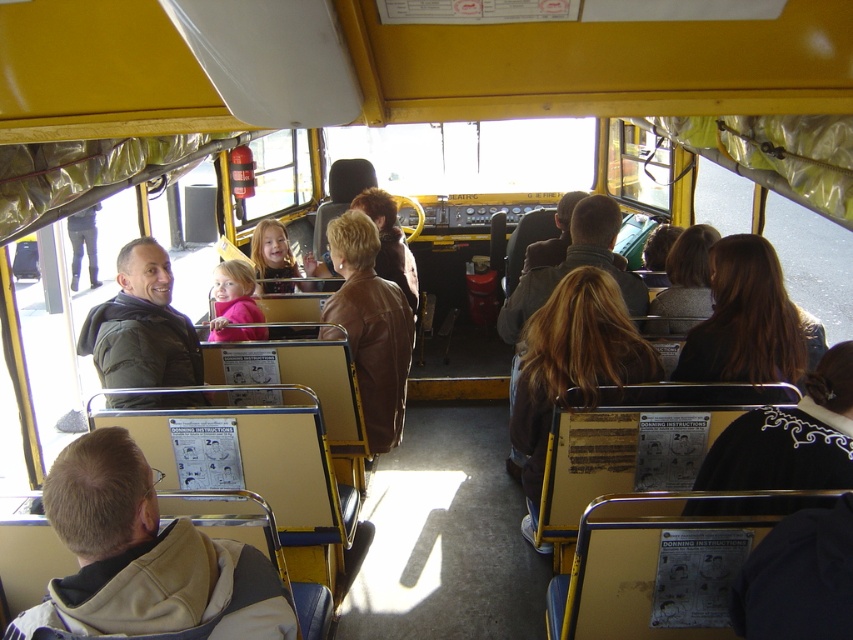
Does blonde hair at center have a greater height compared to brown leather jacket at center?

In fact, blonde hair at center may be shorter than brown leather jacket at center.

Between blonde hair at center and brown leather jacket at center, which one has less height?

blonde hair at center is shorter.

Between point (585, 291) and point (370, 349), which one is positioned behind?

The point (370, 349) is behind.

Locate an element on the screen. This screenshot has height=640, width=853. blonde hair at center is located at coordinates (573, 360).

What do you see at coordinates (144, 560) in the screenshot? I see `beige fabric jacket at lower left` at bounding box center [144, 560].

The height and width of the screenshot is (640, 853). Identify the location of beige fabric jacket at lower left. (144, 560).

Locate an element on the screen. beige fabric jacket at lower left is located at coordinates click(x=144, y=560).

Does blonde hair at center come behind dark brown leather jacket at upper right?

That is False.

Who is positioned more to the right, blonde hair at center or dark brown leather jacket at upper right?

From the viewer's perspective, dark brown leather jacket at upper right appears more on the right side.

The width and height of the screenshot is (853, 640). I want to click on blonde hair at center, so click(x=573, y=360).

The height and width of the screenshot is (640, 853). In order to click on blonde hair at center in this screenshot , I will do `click(573, 360)`.